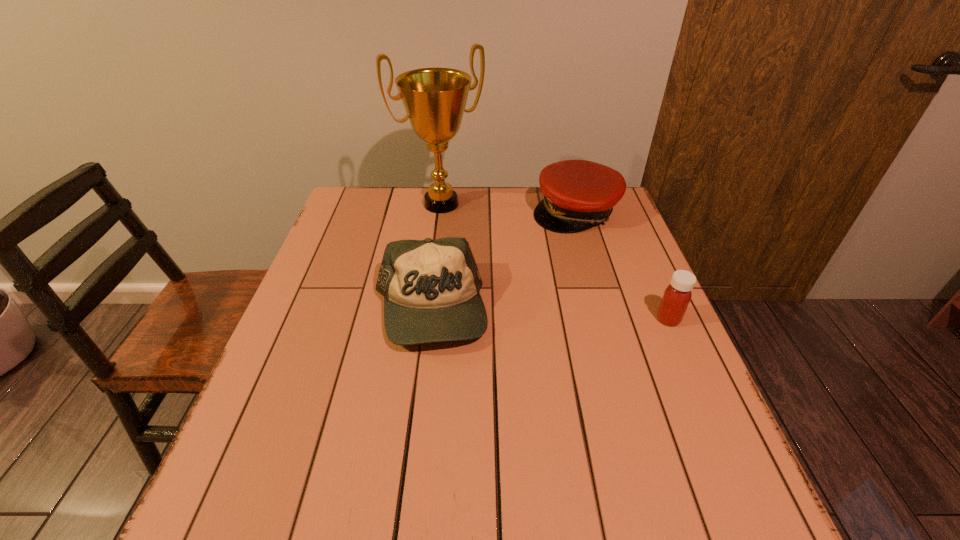
You are a GUI agent. You are given a task and a screenshot of the screen. Output one action in this format:
    pyautogui.click(x=<x>, y=<y>)
    Task: Click on the vacant space at the far left corner of the desktop
    
    Given the screenshot: What is the action you would take?
    pyautogui.click(x=372, y=225)

The height and width of the screenshot is (540, 960). I want to click on unoccupied position between the cap and the baseball cap, so click(x=502, y=261).

Where is `empty space between the cap and the medicine`? The image size is (960, 540). empty space between the cap and the medicine is located at coordinates (622, 265).

Where is `unoccupied area between the tallest object and the medicine`? The height and width of the screenshot is (540, 960). unoccupied area between the tallest object and the medicine is located at coordinates (555, 261).

What are the coordinates of `vacant region between the medicine and the cap` in the screenshot? It's located at (622, 265).

I want to click on vacant space that's between the award and the cap, so click(x=509, y=208).

This screenshot has height=540, width=960. I want to click on vacant space in between the baseball cap and the medicine, so click(x=549, y=315).

The image size is (960, 540). In order to click on free space between the baseball cap and the medicine in this screenshot , I will do `click(549, 315)`.

This screenshot has width=960, height=540. I want to click on the second closest object relative to the medicine, so click(431, 288).

You are a GUI agent. You are given a task and a screenshot of the screen. Output one action in this format:
    pyautogui.click(x=<x>, y=<y>)
    Task: Click on the object that ranks as the closest to the award
    The height and width of the screenshot is (540, 960).
    Given the screenshot: What is the action you would take?
    pyautogui.click(x=578, y=194)